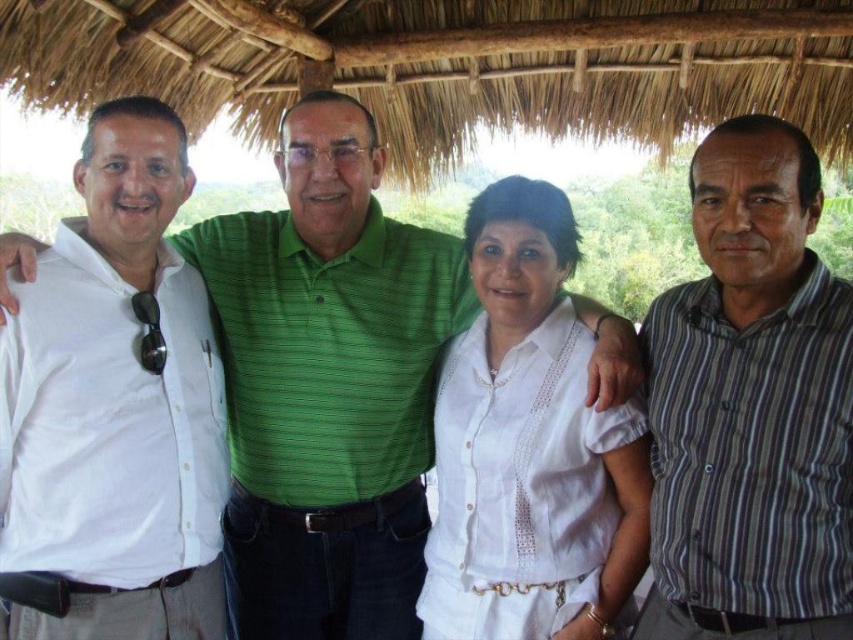
You are standing in front of the group of four people under the thatched roof. You notice two points marked on the image at coordinates point (170,566) and point (633,456). Which point is nearer to you?

Point (170,566) is closer to the viewer than point (633,456), so the first point is nearer to you.

You are organizing a clothing donation drive and need to categorize the white shirt at center and the white cotton blouse at center based on their sizes. Which one should be placed in the large size bin?

The white shirt at center is larger in size than the white cotton blouse at center, so it should be placed in the large size bin.